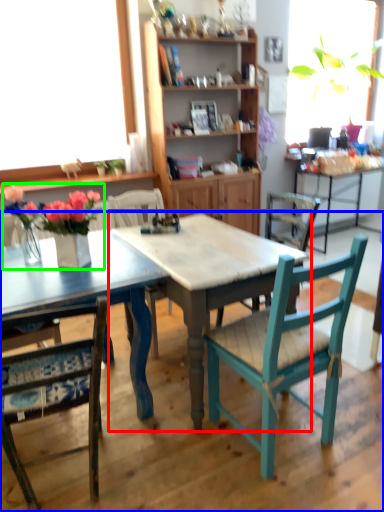
Question: Which object is positioned closest to round table (highlighted by a red box)? Select from table (highlighted by a blue box) and floral arrangement (highlighted by a green box).

Choices:
 (A) table
 (B) floral arrangement

Answer: (A)